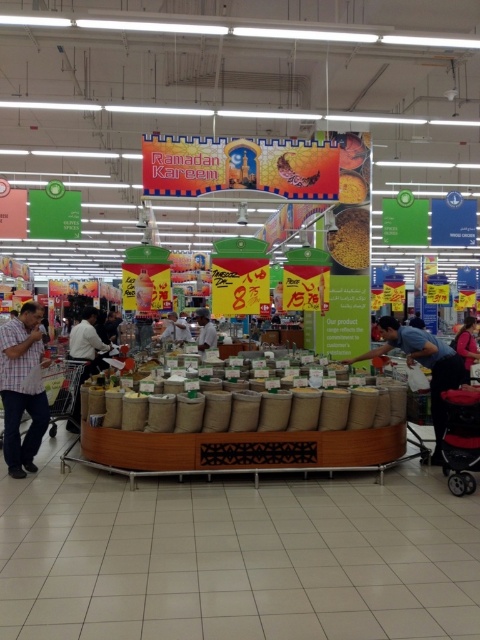
You are a customer in the supermarket and want to place both the yellow matte spice at center and the matte black shirt at center into your shopping basket. Which item should you place first to ensure both fit properly?

You should place the matte black shirt at center first because it is larger in size compared to the yellow matte spice at center, allowing the smaller item to fit into any remaining space.

You are a customer in the supermarket looking for the blue fabric shirt at center. According to the scene, where should you look relative to the burlap sack spice at center?

The blue fabric shirt at center is located above the burlap sack spice at center, so you should look upwards from the burlap sack spice at center to find it.

You are a supermarket employee who needs to place a new shelf that is 3 meters long between the yellow matte spice at center and the matte black shirt at center. Can you fit the shelf in the space between them without moving either object?

The distance between the yellow matte spice at center and the matte black shirt at center is 3.65 meters. Since the shelf is 3 meters long, it can be placed between them as the available space is longer than the shelf.